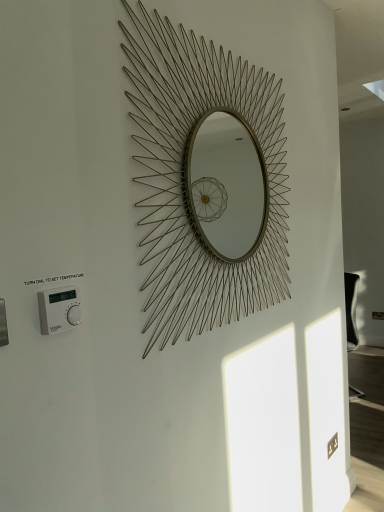
Question: From a real-world perspective, relative to gold wire mirror at center, is white plastic thermostat at lower left vertically above or below?

Choices:
 (A) below
 (B) above

Answer: (A)

Question: Looking at the image, does white plastic thermostat at lower left seem bigger or smaller compared to gold wire mirror at center?

Choices:
 (A) big
 (B) small

Answer: (B)

Question: In the image, is white plastic thermostat at lower left positioned in front of or behind gold wire mirror at center?

Choices:
 (A) behind
 (B) front

Answer: (B)

Question: Considering their positions, is gold wire mirror at center located in front of or behind white plastic thermostat at lower left?

Choices:
 (A) behind
 (B) front

Answer: (A)

Question: From the image's perspective, is gold wire mirror at center positioned above or below white plastic thermostat at lower left?

Choices:
 (A) below
 (B) above

Answer: (B)

Question: Based on their sizes in the image, would you say gold wire mirror at center is bigger or smaller than white plastic thermostat at lower left?

Choices:
 (A) small
 (B) big

Answer: (B)

Question: Considering the positions of gold wire mirror at center and white plastic thermostat at lower left in the image, is gold wire mirror at center wider or thinner than white plastic thermostat at lower left?

Choices:
 (A) thin
 (B) wide

Answer: (B)